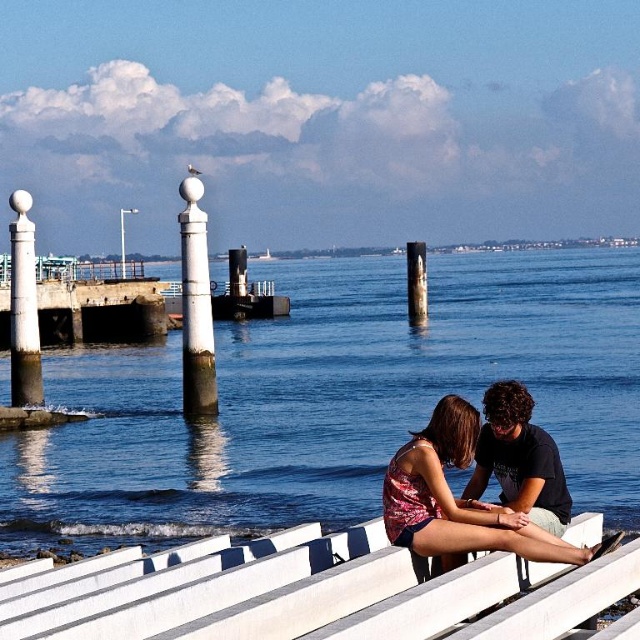
You are a GUI agent. You are given a task and a screenshot of the screen. Output one action in this format:
    pyautogui.click(x=<x>, y=<y>)
    Task: Click on the dark blue t-shirt at center
    The width and height of the screenshot is (640, 640).
    Given the screenshot: What is the action you would take?
    pyautogui.click(x=518, y=460)

Where is `dark blue t-shirt at center`? The image size is (640, 640). dark blue t-shirt at center is located at coordinates (518, 460).

Is pink floral tank top at center positioned before white polished stone post at left?

Yes.

Is pink floral tank top at center to the left of white polished stone post at left from the viewer's perspective?

No, pink floral tank top at center is not to the left of white polished stone post at left.

Is point (419, 477) positioned behind point (26, 300)?

No, (419, 477) is closer to viewer.

Identify the location of pink floral tank top at center. (460, 500).

Who is positioned more to the right, dark blue t-shirt at center or smooth concrete post at center?

Positioned to the right is smooth concrete post at center.

Based on the photo, is dark blue t-shirt at center to the left of smooth concrete post at center from the viewer's perspective?

Indeed, dark blue t-shirt at center is positioned on the left side of smooth concrete post at center.

Who is more forward, (529, 435) or (419, 300)?

Point (529, 435) is in front.

Find the location of a particular element. The image size is (640, 640). dark blue t-shirt at center is located at coordinates (518, 460).